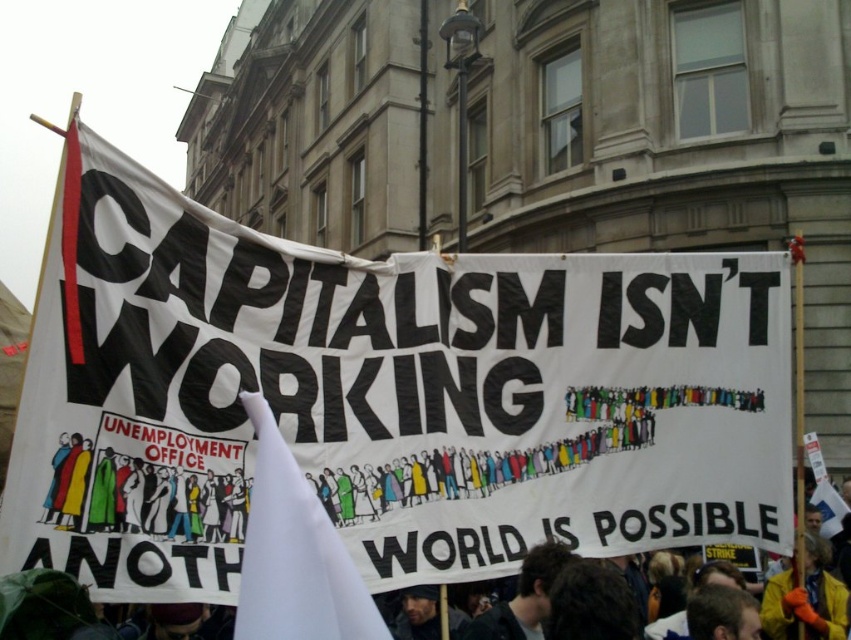
Between white fabric banner at center and white fabric at center, which one appears on the left side from the viewer's perspective?

From the viewer's perspective, white fabric at center appears more on the left side.

Which is below, white fabric banner at center or white fabric at center?

white fabric at center

Between point (455, 428) and point (661, 508), which one is positioned in front?

Point (455, 428) is in front.

The image size is (851, 640). I want to click on white fabric banner at center, so click(x=381, y=397).

Does point (295, 390) lie behind point (357, 572)?

Yes.

Can you confirm if white fabric banner at center is wider than white fabric flag at center?

Correct, the width of white fabric banner at center exceeds that of white fabric flag at center.

Does point (586, 429) lie in front of point (317, 529)?

No, (586, 429) is behind (317, 529).

This screenshot has height=640, width=851. I want to click on white fabric banner at center, so click(x=381, y=397).

Can you confirm if white fabric at center is positioned to the left of white fabric flag at center?

Incorrect, white fabric at center is not on the left side of white fabric flag at center.

In the scene shown: Is white fabric at center taller than white fabric flag at center?

Indeed, white fabric at center has a greater height compared to white fabric flag at center.

Is point (363, 500) farther from viewer compared to point (301, 632)?

Yes.

The image size is (851, 640). Find the location of `white fabric at center`. white fabric at center is located at coordinates (535, 504).